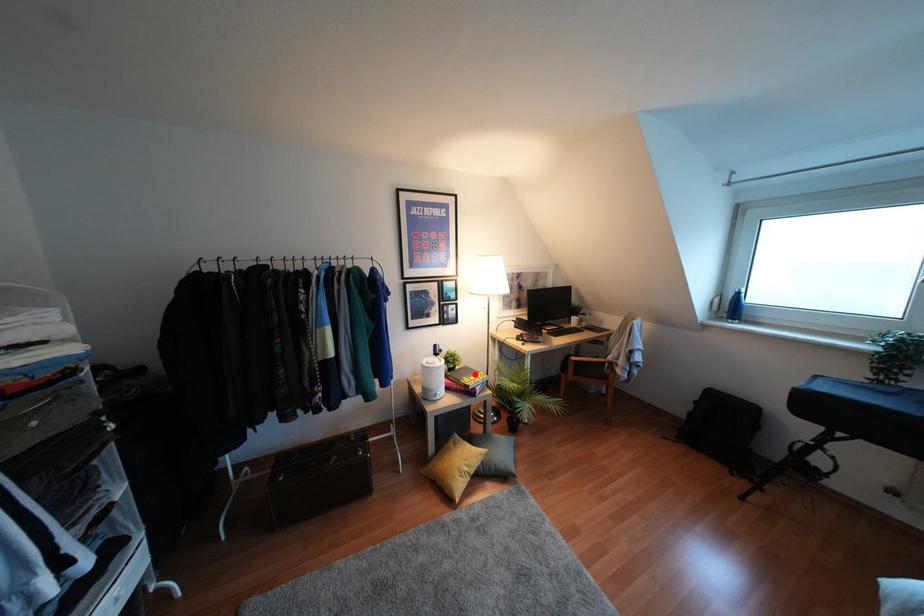
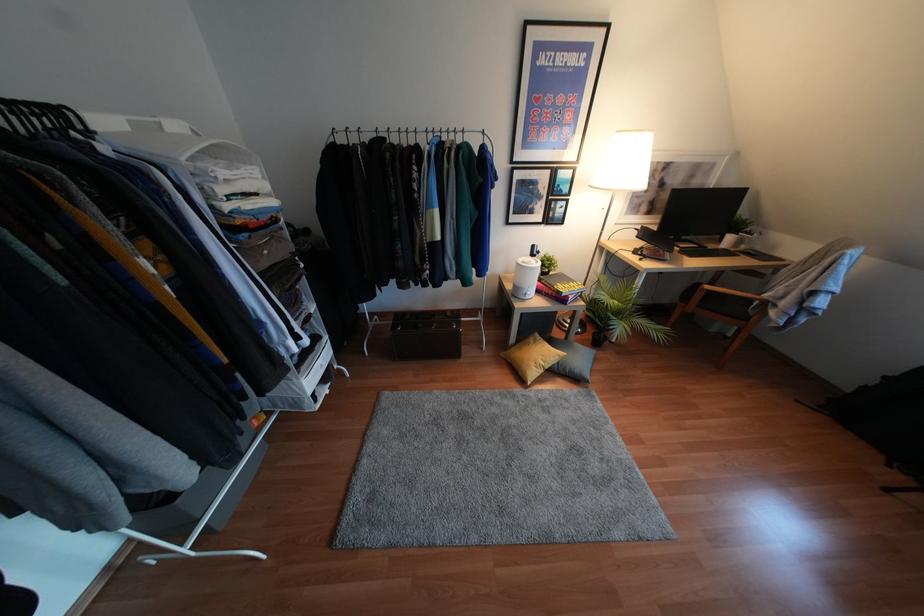
Where in the second image is the point corresponding to the highlighted location from the first image?

(570, 283)